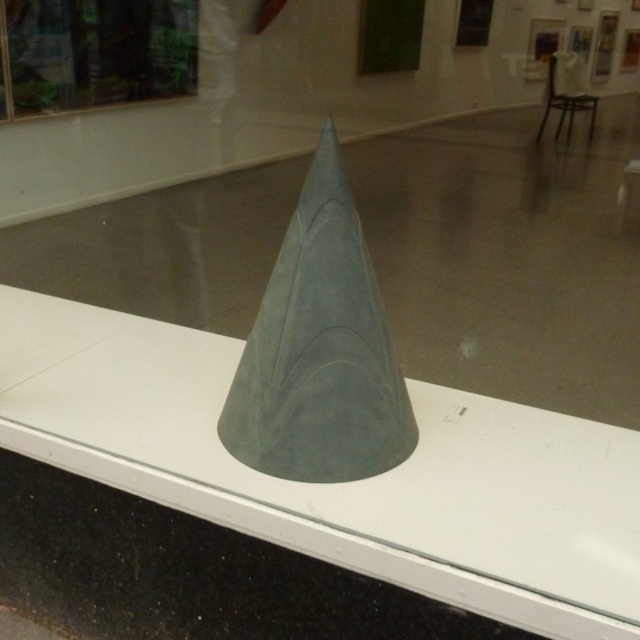
You are an art curator planning to install a new sculpture in the gallery. You want to place a new sculpture that is 1.5 meters tall at the point marked by coordinates point (340, 483). Will this new sculpture block the view of the existing transparent glass cone at center? Please explain your reasoning.

The point (340, 483) marks the location of the transparent glass cone at center. Placing a new sculpture 1.5 meters tall at that exact point would directly occupy the same space, thus blocking the view of the existing transparent glass cone at center.

You are standing in an art gallery and see two points marked on the floor near the sculpture. The first point is labeled as point (x=205, y=513) and the second is point (x=310, y=300). If you want to walk towards the sculpture, which point should you step on first?

You should step on point (x=310, y=300) first because it is in front of point (x=205, y=513), which is behind it.

You are an art curator planning to photograph the transparent glass cone at center and the suede gray cone at center. To ensure both are visible in the photo, which cone should you position closer to the camera?

The transparent glass cone at center should be positioned closer to the camera because it is already in front of the suede gray cone at center, ensuring both are visible without one blocking the other.